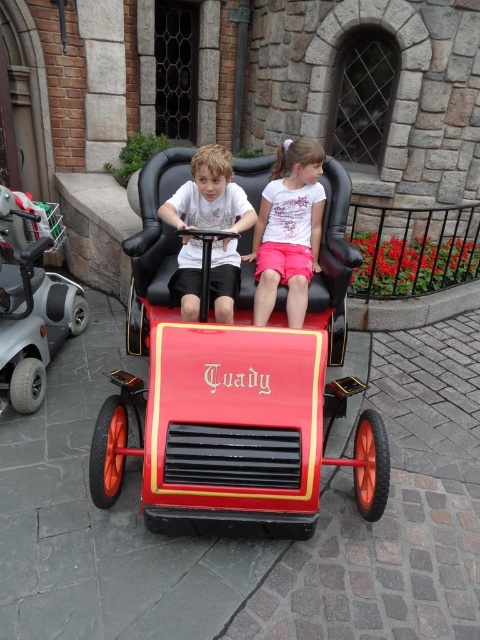
Who is shorter, pink cotton shorts at center or matte white shirt at center?

matte white shirt at center is shorter.

Which is behind, point (320, 212) or point (189, 184)?

Positioned behind is point (320, 212).

Describe the element at coordinates (288, 230) in the screenshot. I see `pink cotton shorts at center` at that location.

Locate an element on the screen. The width and height of the screenshot is (480, 640). pink cotton shorts at center is located at coordinates (288, 230).

How distant is shiny red toy car at center from matte white shirt at center?

The distance of shiny red toy car at center from matte white shirt at center is 5.05 inches.

You are a GUI agent. You are given a task and a screenshot of the screen. Output one action in this format:
    pyautogui.click(x=<x>, y=<y>)
    Task: Click on the shiny red toy car at center
    Image resolution: width=480 pixels, height=640 pixels.
    Given the screenshot: What is the action you would take?
    pyautogui.click(x=238, y=371)

Is point (288, 497) closer to viewer compared to point (173, 211)?

Yes.

Find the location of a particular element. Image resolution: width=480 pixels, height=640 pixels. shiny red toy car at center is located at coordinates (238, 371).

Is shiny red toy car at center closer to camera compared to pink cotton shorts at center?

Yes.

Is shiny red toy car at center below pink cotton shorts at center?

Yes, shiny red toy car at center is below pink cotton shorts at center.

Identify the location of shiny red toy car at center. (238, 371).

Where is `shiny red toy car at center`? shiny red toy car at center is located at coordinates (238, 371).